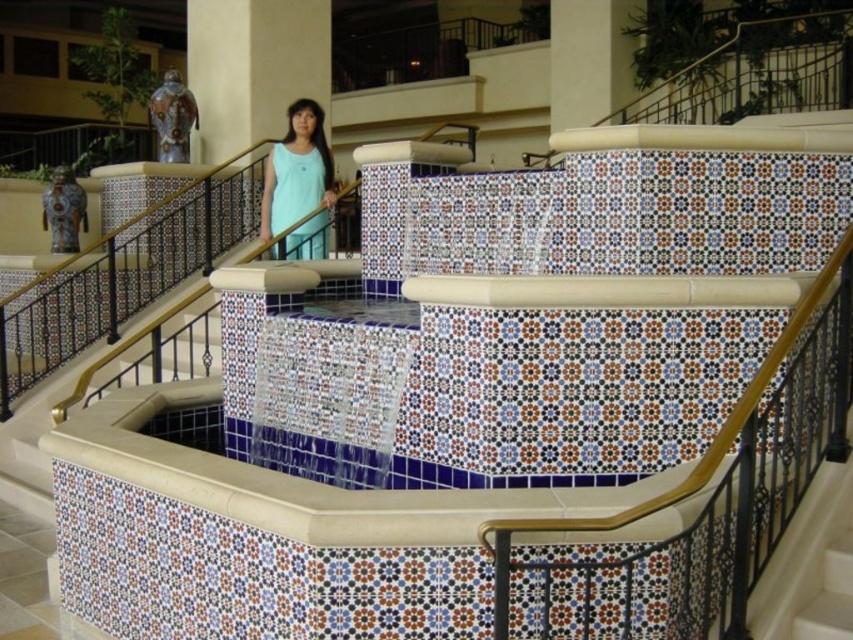
You are a photographer planning to shoot a fashion editorial in this space. You have a light blue fabric dress at center and a beige marble pillar at upper center. Which item would be more suitable to use as a prop for a slimming effect in your photos?

The light blue fabric dress at center is thinner than the beige marble pillar at upper center, making it a better choice for creating a slimming effect in the photos.

You are standing in the luxurious interior space and see the light blue fabric dress at center and the beige marble pillar at upper center. Which object is nearer to you?

The light blue fabric dress at center is closer to the viewer than the beige marble pillar at upper center.

You are a maintenance worker needing to place a 5.25 meter long decorative banner between the matte ceramic vase at upper center and the beige marble pillar at upper center. Can the banner fit between them without overlapping either object?

The distance between the matte ceramic vase at upper center and the beige marble pillar at upper center is 5.30 meters. Since the banner is 5.25 meters long, it will fit between them with a small gap of 0.05 meters remaining. Therefore, the banner can be placed without overlapping either object.